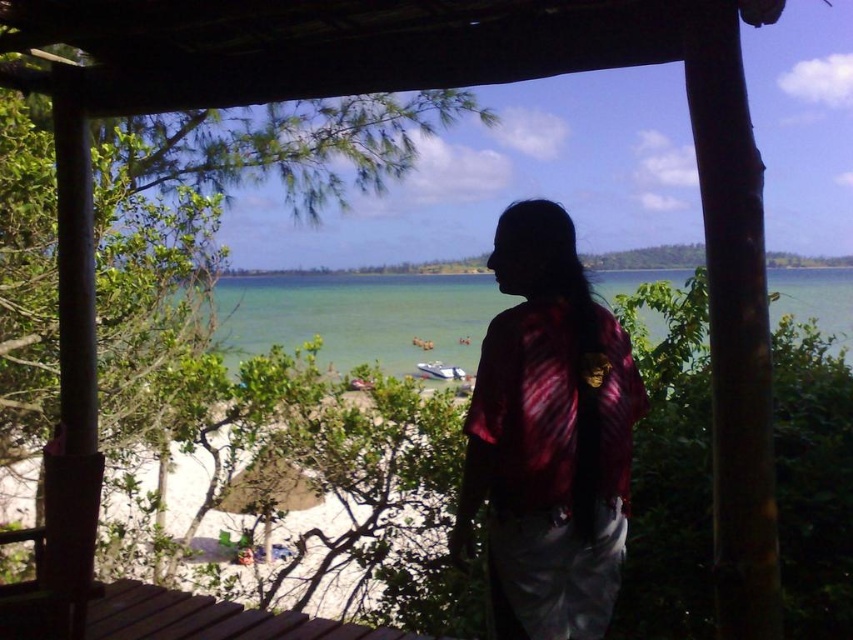
Who is more distant from viewer, (450,344) or (329,627)?

The point (450,344) is more distant.

Is point (368, 276) closer to viewer compared to point (193, 609)?

That is False.

This screenshot has width=853, height=640. In order to click on clear water at center in this screenshot , I will do `click(358, 316)`.

Does brown wooden deck at lower left have a smaller size compared to white glossy boat at center?

Incorrect, brown wooden deck at lower left is not smaller in size than white glossy boat at center.

I want to click on brown wooden deck at lower left, so coord(209,618).

Between point (556, 365) and point (430, 314), which one is positioned behind?

Positioned behind is point (430, 314).

The width and height of the screenshot is (853, 640). Find the location of `maroon tie-dye shirt at center`. maroon tie-dye shirt at center is located at coordinates 549,436.